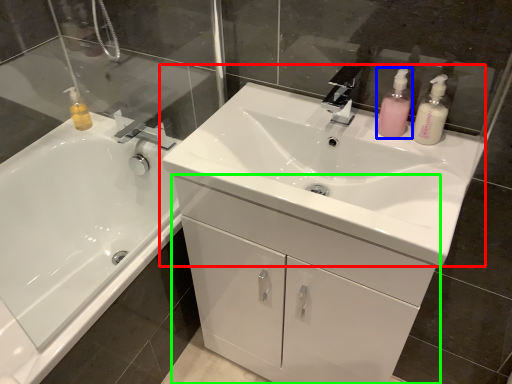
Question: Considering the real-world distances, which object is farthest from sink (highlighted by a red box)? toiletry (highlighted by a blue box) or bathroom cabinet (highlighted by a green box)?

Choices:
 (A) toiletry
 (B) bathroom cabinet

Answer: (A)